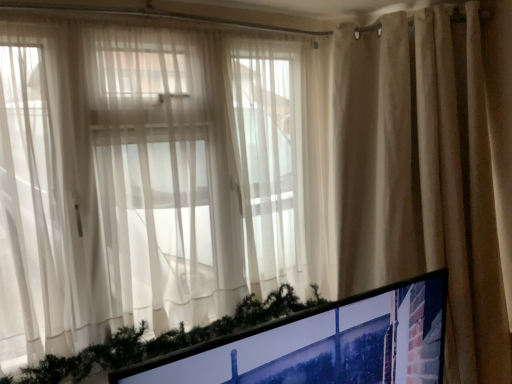
Question: From the image's perspective, does beige fabric curtain at upper right appear lower than matte black monitor at lower right?

Choices:
 (A) no
 (B) yes

Answer: (A)

Question: Is beige fabric curtain at upper right positioned beyond the bounds of matte black monitor at lower right?

Choices:
 (A) no
 (B) yes

Answer: (B)

Question: From a real-world perspective, is beige fabric curtain at upper right located beneath matte black monitor at lower right?

Choices:
 (A) yes
 (B) no

Answer: (B)

Question: Is matte black monitor at lower right at the back of beige fabric curtain at upper right?

Choices:
 (A) no
 (B) yes

Answer: (A)

Question: Would you say beige fabric curtain at upper right is a long distance from matte black monitor at lower right?

Choices:
 (A) no
 (B) yes

Answer: (A)

Question: Is beige fabric curtain at upper right positioned behind matte black monitor at lower right?

Choices:
 (A) yes
 (B) no

Answer: (A)

Question: From a real-world perspective, is matte black monitor at lower right positioned under beige fabric curtain at upper right based on gravity?

Choices:
 (A) yes
 (B) no

Answer: (A)

Question: Considering the relative sizes of matte black monitor at lower right and beige fabric curtain at upper right in the image provided, is matte black monitor at lower right bigger than beige fabric curtain at upper right?

Choices:
 (A) no
 (B) yes

Answer: (A)

Question: Is matte black monitor at lower right behind beige fabric curtain at upper right?

Choices:
 (A) no
 (B) yes

Answer: (A)

Question: Is matte black monitor at lower right positioned beyond the bounds of beige fabric curtain at upper right?

Choices:
 (A) yes
 (B) no

Answer: (A)

Question: Considering the relative sizes of matte black monitor at lower right and beige fabric curtain at upper right in the image provided, is matte black monitor at lower right shorter than beige fabric curtain at upper right?

Choices:
 (A) no
 (B) yes

Answer: (B)

Question: From the image's perspective, is matte black monitor at lower right located beneath beige fabric curtain at upper right?

Choices:
 (A) no
 (B) yes

Answer: (B)

Question: Is beige fabric curtain at upper right bigger or smaller than matte black monitor at lower right?

Choices:
 (A) big
 (B) small

Answer: (A)